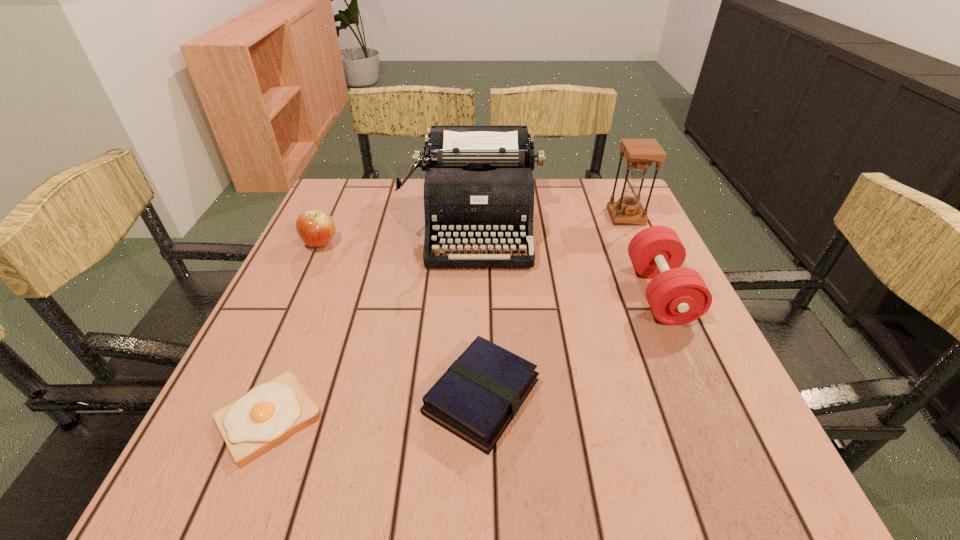
The height and width of the screenshot is (540, 960). What are the coordinates of `free space between the hourglass and the shortest object` in the screenshot? It's located at (447, 318).

I want to click on blank region between the hourglass and the second shortest object, so click(x=554, y=307).

Where is `vacant area between the typewriter and the toast`? This screenshot has width=960, height=540. vacant area between the typewriter and the toast is located at coordinates (372, 321).

Identify the location of free space between the fifth tallest object and the apple. (400, 320).

Image resolution: width=960 pixels, height=540 pixels. What are the coordinates of `vacant area that lies between the third shortest object and the book` in the screenshot? It's located at (400, 320).

Identify which object is located as the fifth nearest to the book. Please provide its 2D coordinates. Your answer should be formatted as a tuple, i.e. [(x, y)], where the tuple contains the x and y coordinates of a point satisfying the conditions above.

[(640, 153)]

The width and height of the screenshot is (960, 540). Identify the location of object that is the second nearest to the hourglass. (478, 189).

You are a GUI agent. You are given a task and a screenshot of the screen. Output one action in this format:
    pyautogui.click(x=<x>, y=<y>)
    Task: Click on the free space that satisfies the following two spatial constraints: 1. on the back side of the fourth tallest object; 2. on the right side of the hourglass
    
    Given the screenshot: What is the action you would take?
    pyautogui.click(x=332, y=217)

Identify the location of free space in the image that satisfies the following two spatial constraints: 1. on the back side of the hourglass; 2. on the left side of the second shortest object. The image size is (960, 540). (481, 217).

Identify the location of free space that satisfies the following two spatial constraints: 1. on the typing side of the typewriter; 2. on the right side of the book. The height and width of the screenshot is (540, 960). (472, 396).